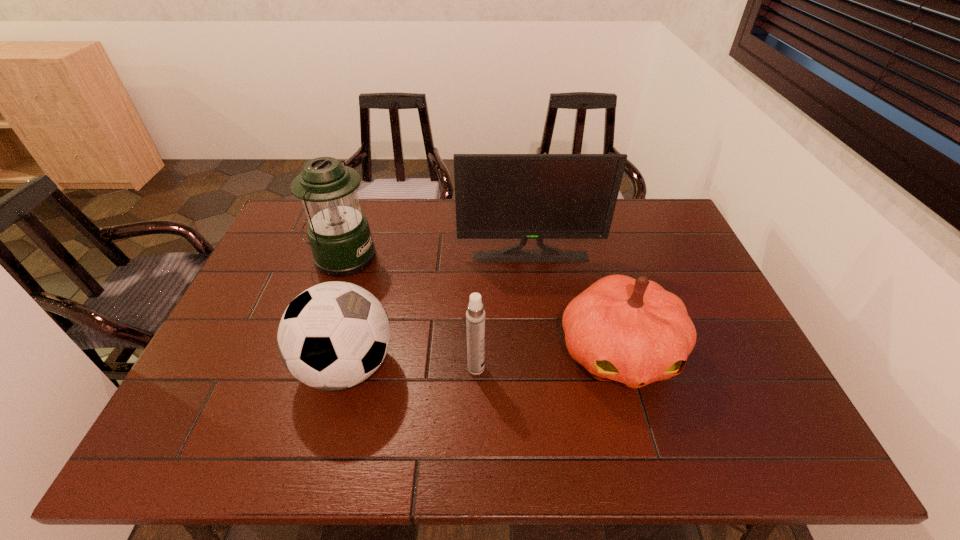
Where is `monitor`? The height and width of the screenshot is (540, 960). monitor is located at coordinates (498, 196).

Where is `lantern`? This screenshot has width=960, height=540. lantern is located at coordinates (339, 235).

Find the location of a particular element. The image size is (960, 540). pumpkin is located at coordinates (631, 331).

Identify the location of aerosol can. (475, 315).

You are a GUI agent. You are given a task and a screenshot of the screen. Output one action in this format:
    pyautogui.click(x=<x>, y=<y>)
    Task: Click on the soccer ball
    Image resolution: width=960 pixels, height=540 pixels.
    Given the screenshot: What is the action you would take?
    pyautogui.click(x=334, y=335)

Locate an element on the screen. The height and width of the screenshot is (540, 960). vacant space located 0.270m on the front-facing side of the monitor is located at coordinates (540, 329).

Locate an element on the screen. free spot located 0.140m on the back of the lantern is located at coordinates (358, 214).

The width and height of the screenshot is (960, 540). Find the location of `vacant space situated 0.100m on the front-facing side of the pumpkin`. vacant space situated 0.100m on the front-facing side of the pumpkin is located at coordinates (646, 446).

Find the location of a particular element. This screenshot has height=540, width=960. vacant space situated on the left of the aerosol can is located at coordinates (447, 368).

Identify the location of vacant space positioned 0.220m on the main logo of the soccer ball. The width and height of the screenshot is (960, 540). (487, 367).